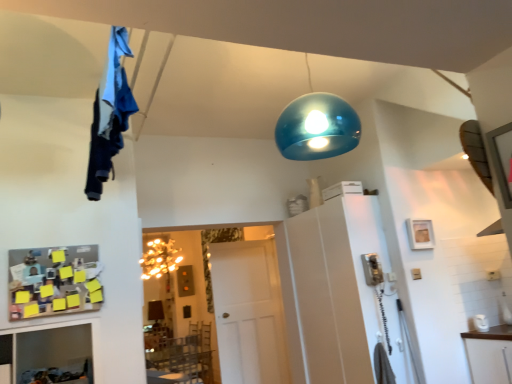
Question: Is point (65, 286) closer or farther from the camera than point (411, 223)?

Choices:
 (A) closer
 (B) farther

Answer: (A)

Question: In the image, is wooden pegboard with sticky notes at lower left positioned in front of or behind wooden picture frame at upper right?

Choices:
 (A) behind
 (B) front

Answer: (B)

Question: Which of these objects is positioned closest to the wooden picture frame at upper right?

Choices:
 (A) white matte door at center
 (B) wooden pegboard with sticky notes at lower left
 (C) blue fabric at upper left
 (D) white glossy cabinet at right

Answer: (D)

Question: Considering the real-world distances, which object is farthest from the wooden picture frame at upper right?

Choices:
 (A) white matte door at center
 (B) white glossy cabinet at right
 (C) blue fabric at upper left
 (D) wooden pegboard with sticky notes at lower left

Answer: (D)